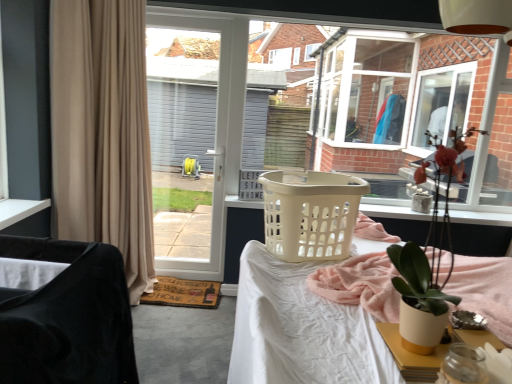
Question: Can you confirm if velvet black chair at left is positioned to the left of beige plastic laundry basket at center?

Choices:
 (A) no
 (B) yes

Answer: (B)

Question: Does velvet black chair at left have a smaller size compared to beige plastic laundry basket at center?

Choices:
 (A) yes
 (B) no

Answer: (B)

Question: Does velvet black chair at left lie behind beige plastic laundry basket at center?

Choices:
 (A) yes
 (B) no

Answer: (B)

Question: Are velvet black chair at left and beige plastic laundry basket at center located far from each other?

Choices:
 (A) yes
 (B) no

Answer: (B)

Question: Is velvet black chair at left facing away from beige plastic laundry basket at center?

Choices:
 (A) yes
 (B) no

Answer: (B)

Question: From a real-world perspective, is beige plastic laundry basket at center above or below beige fabric curtain at left?

Choices:
 (A) below
 (B) above

Answer: (A)

Question: In terms of height, does beige plastic laundry basket at center look taller or shorter compared to beige fabric curtain at left?

Choices:
 (A) tall
 (B) short

Answer: (B)

Question: In terms of width, does beige plastic laundry basket at center look wider or thinner when compared to beige fabric curtain at left?

Choices:
 (A) thin
 (B) wide

Answer: (B)

Question: Relative to beige fabric curtain at left, is beige plastic laundry basket at center in front or behind?

Choices:
 (A) front
 (B) behind

Answer: (A)

Question: Considering the positions of point (312, 183) and point (189, 248), is point (312, 183) closer or farther from the camera than point (189, 248)?

Choices:
 (A) closer
 (B) farther

Answer: (A)

Question: In terms of size, does beige plastic laundry basket at center appear bigger or smaller than white plastic screen door at center?

Choices:
 (A) small
 (B) big

Answer: (A)

Question: Is beige plastic laundry basket at center wider or thinner than white plastic screen door at center?

Choices:
 (A) wide
 (B) thin

Answer: (A)

Question: Do you think beige plastic laundry basket at center is within white plastic screen door at center, or outside of it?

Choices:
 (A) inside
 (B) outside

Answer: (B)

Question: Does point (49, 349) appear closer or farther from the camera than point (148, 173)?

Choices:
 (A) farther
 (B) closer

Answer: (B)

Question: Considering their positions, is velvet black chair at left located in front of or behind beige fabric curtain at left?

Choices:
 (A) behind
 (B) front

Answer: (B)